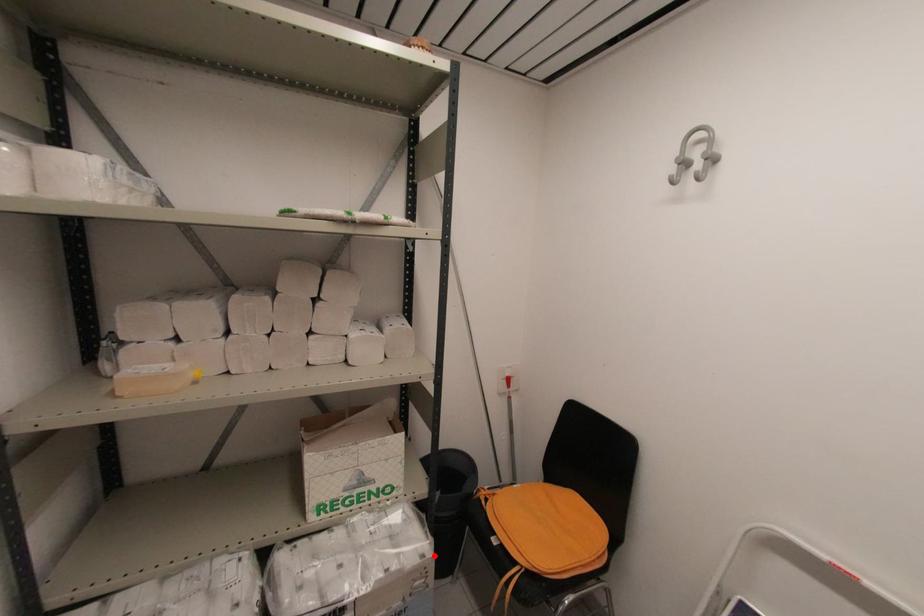
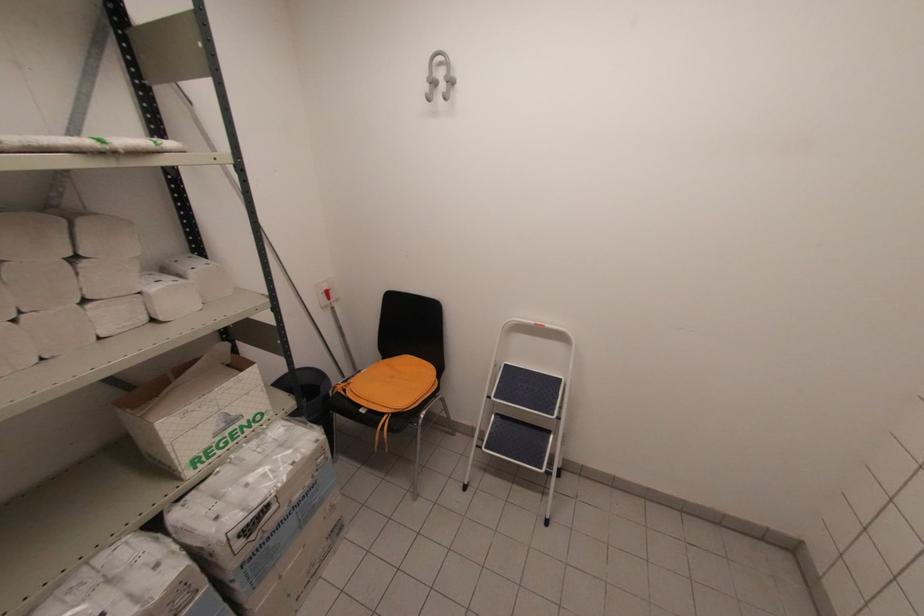
Find the pixel in the second image that matches the highlighted location in the first image.

(325, 437)